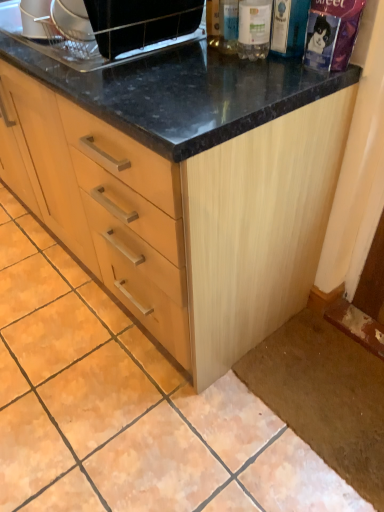
Locate an element on the screen. The image size is (384, 512). free space that is to the left of clear glass bottle at upper center, arranged as the 3th bottle when viewed from the right is located at coordinates pyautogui.click(x=173, y=56).